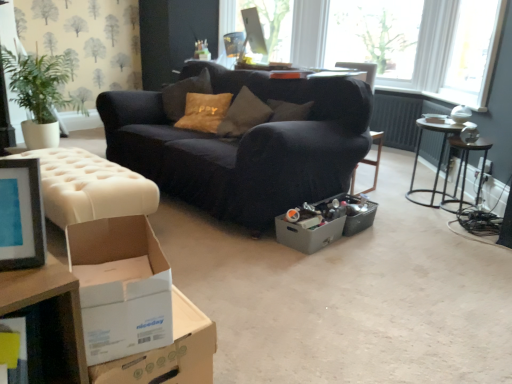
Question: From a real-world perspective, is white glossy table at upper center, the first table viewed from the top, over white tufted ottoman at left?

Choices:
 (A) no
 (B) yes

Answer: (B)

Question: Could you tell me if white glossy table at upper center, which appears as the 1th table when viewed from the left, is turned towards white tufted ottoman at left?

Choices:
 (A) yes
 (B) no

Answer: (B)

Question: Can you see white glossy table at upper center, which appears as the 1th table when viewed from the left, touching white tufted ottoman at left?

Choices:
 (A) yes
 (B) no

Answer: (B)

Question: Are white glossy table at upper center, which ranks as the 2th table in right-to-left order, and white tufted ottoman at left far apart?

Choices:
 (A) yes
 (B) no

Answer: (A)

Question: Considering the relative positions of white glossy table at upper center, which appears as the 1th table when viewed from the left, and white tufted ottoman at left in the image provided, is white glossy table at upper center, which appears as the 1th table when viewed from the left, behind white tufted ottoman at left?

Choices:
 (A) no
 (B) yes

Answer: (B)

Question: Is metallic silver table at right, acting as the 1th table starting from the right, situated inside metallic gray storage box at center or outside?

Choices:
 (A) inside
 (B) outside

Answer: (B)

Question: Is metallic silver table at right, acting as the 1th table starting from the right, to the left or to the right of metallic gray storage box at center in the image?

Choices:
 (A) right
 (B) left

Answer: (A)

Question: Considering the positions of metallic silver table at right, arranged as the 1th table when ordered from the bottom, and metallic gray storage box at center in the image, is metallic silver table at right, arranged as the 1th table when ordered from the bottom, wider or thinner than metallic gray storage box at center?

Choices:
 (A) thin
 (B) wide

Answer: (B)

Question: From a real-world perspective, relative to metallic gray storage box at center, is metallic silver table at right, which is the second table from left to right, vertically above or below?

Choices:
 (A) below
 (B) above

Answer: (B)

Question: Based on their sizes in the image, would you say white glossy table at upper center, the first table viewed from the top, is bigger or smaller than white cardboard box at lower left, the second cardboard box from the left?

Choices:
 (A) big
 (B) small

Answer: (B)

Question: Is white glossy table at upper center, which ranks as the 2th table in right-to-left order, spatially inside white cardboard box at lower left, the first cardboard box positioned from the front, or outside of it?

Choices:
 (A) inside
 (B) outside

Answer: (B)

Question: Considering the relative positions of white glossy table at upper center, which ranks as the 2th table in right-to-left order, and white cardboard box at lower left, the second cardboard box from the left, in the image provided, is white glossy table at upper center, which ranks as the 2th table in right-to-left order, to the left or to the right of white cardboard box at lower left, the second cardboard box from the left,?

Choices:
 (A) right
 (B) left

Answer: (A)

Question: From a real-world perspective, is white glossy table at upper center, the first table viewed from the top, positioned above or below white cardboard box at lower left, the first cardboard box positioned from the front?

Choices:
 (A) below
 (B) above

Answer: (B)

Question: From the image's perspective, is white cardboard box at lower left, the first cardboard box positioned from the front, above or below metallic dark brown side table at right?

Choices:
 (A) below
 (B) above

Answer: (A)

Question: Based on their positions, is white cardboard box at lower left, the second cardboard box from the left, located to the left or right of metallic dark brown side table at right?

Choices:
 (A) left
 (B) right

Answer: (A)